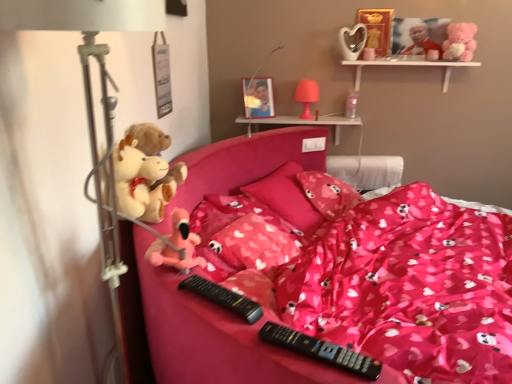
Where is `vacant area that lies to the right of metallic photo frame at upper center`? This screenshot has height=384, width=512. vacant area that lies to the right of metallic photo frame at upper center is located at coordinates (282, 121).